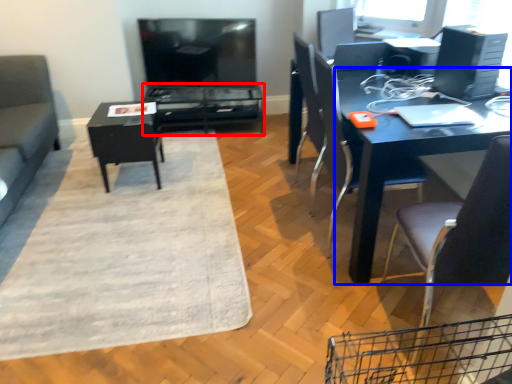
Question: Which object appears closest to the camera in this image, table (highlighted by a red box) or desk (highlighted by a blue box)?

Choices:
 (A) table
 (B) desk

Answer: (B)